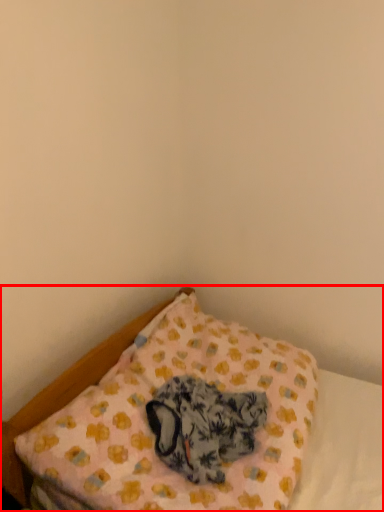
Question: From the image's perspective, what is the correct spatial relationship of bed (annotated by the red box) in relation to animal?

Choices:
 (A) below
 (B) above

Answer: (B)